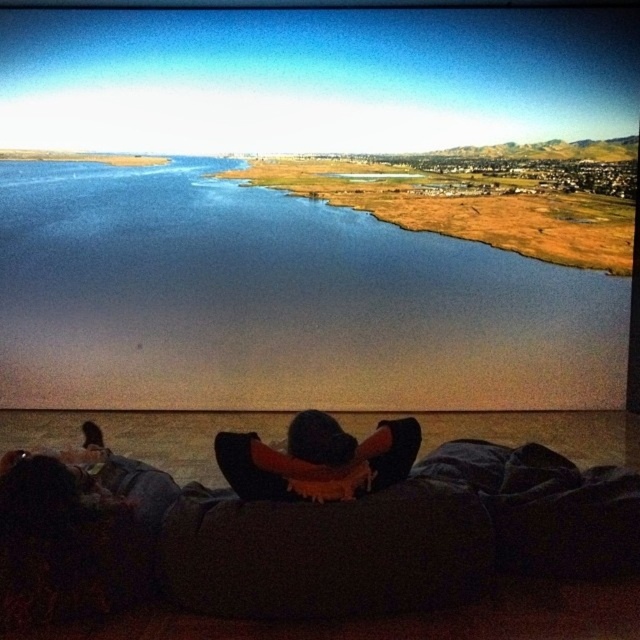
You are sitting in the darkened room and want to know which object in the scene is bigger between the blue water at center and the black fuzzy hat at center. Could you tell me?

The blue water at center is larger in size than the black fuzzy hat at center.

You are sitting in a cinema and see the blue water at center and the black fuzzy hat at center on the screen. Which object is located to the left when viewed from your perspective?

The blue water at center is positioned on the left side of the black fuzzy hat at center, so the blue water at center is to the left.